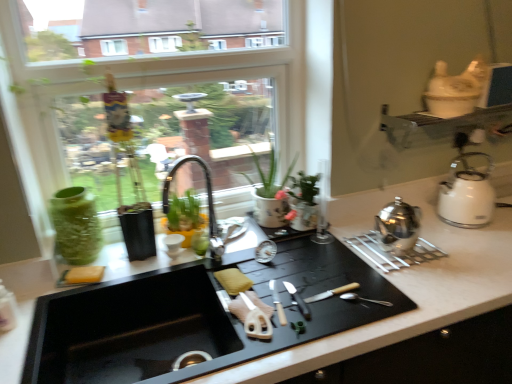
Locate an element on the screen. Image resolution: width=512 pixels, height=384 pixels. free spot to the right of satin silver teapot at right, marked as the 2th kitchen appliance in a right-to-left arrangement is located at coordinates (449, 247).